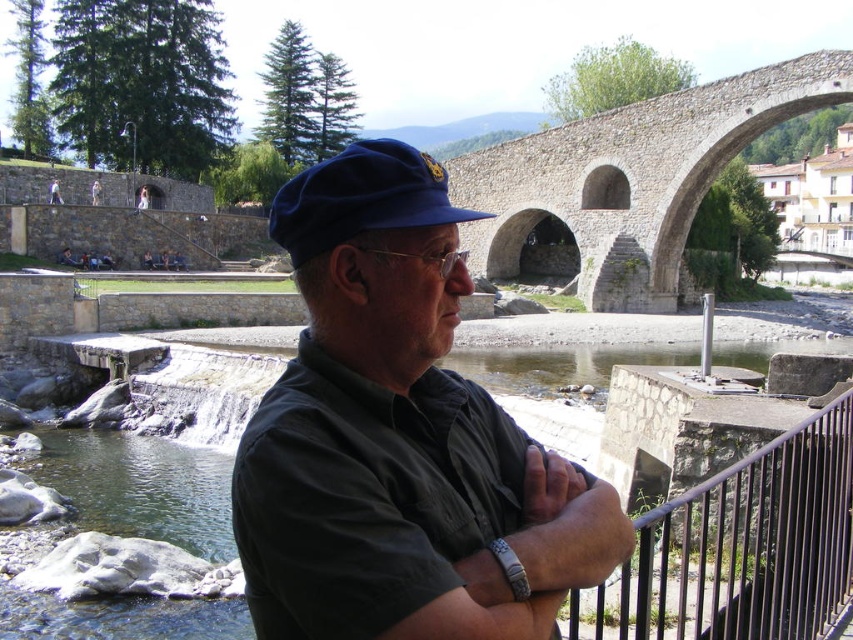
Is dark blue uniform at center positioned before black metal railing at lower right?

That is True.

Which is in front, point (347, 529) or point (769, 481)?

Point (347, 529) is more forward.

This screenshot has width=853, height=640. Describe the element at coordinates (399, 436) in the screenshot. I see `dark blue uniform at center` at that location.

Where is `dark blue uniform at center`? Image resolution: width=853 pixels, height=640 pixels. dark blue uniform at center is located at coordinates (399, 436).

From the picture: Which is below, dark blue uniform at center or blue velvety cap at center?

dark blue uniform at center is lower down.

Is point (451, 333) more distant than point (283, 241)?

That is True.

This screenshot has width=853, height=640. I want to click on dark blue uniform at center, so click(x=399, y=436).

Based on the photo, does stone arch bridge at upper center have a greater height compared to blue velvety cap at center?

Indeed, stone arch bridge at upper center has a greater height compared to blue velvety cap at center.

Find the location of `stone arch bridge at upper center`. stone arch bridge at upper center is located at coordinates (631, 179).

I want to click on stone arch bridge at upper center, so click(631, 179).